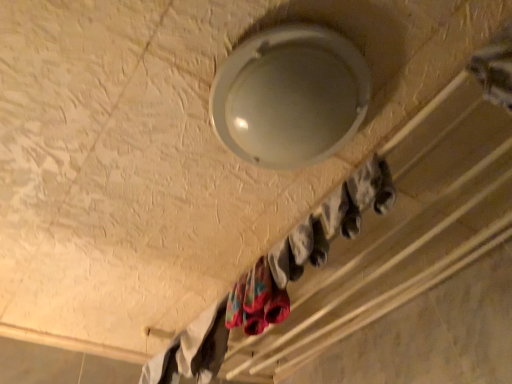
Question: From a real-world perspective, relative to white cotton socks at lower left, the first clothing positioned from the bottom, is white matte socks at upper center vertically above or below?

Choices:
 (A) below
 (B) above

Answer: (B)

Question: Does point (501, 230) appear closer or farther from the camera than point (219, 332)?

Choices:
 (A) farther
 (B) closer

Answer: (A)

Question: Estimate the real-world distances between objects in this image. Which object is closer to the white matte socks at upper center?

Choices:
 (A) white cotton socks at lower left, positioned as the second clothing in top-to-bottom order
 (B) multicolored fabric socks at lower center, the first clothing from the top

Answer: (A)

Question: Estimate the real-world distances between objects in this image. Which object is farther from the white cotton socks at lower left, the first clothing positioned from the bottom?

Choices:
 (A) white matte socks at upper center
 (B) multicolored fabric socks at lower center, the first clothing from the top

Answer: (A)